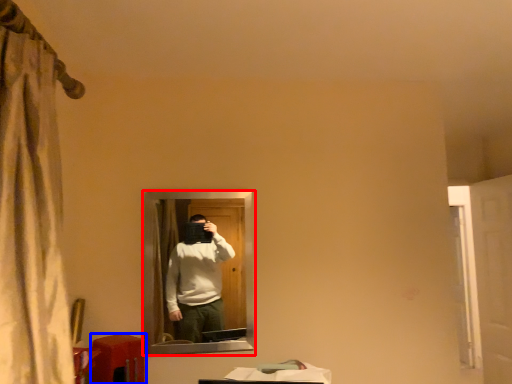
Question: Which of the following is the farthest to the observer, mirror (highlighted by a red box) or table (highlighted by a blue box)?

Choices:
 (A) mirror
 (B) table

Answer: (A)